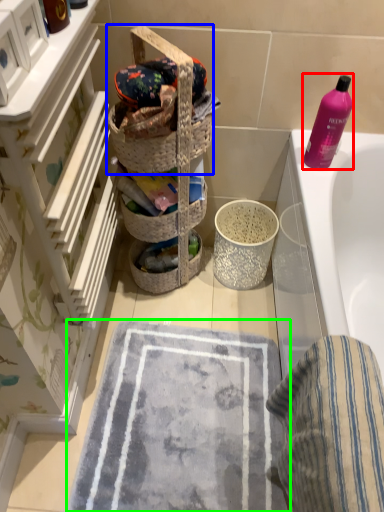
Question: Which object is positioned closest to cleaning product (highlighted by a red box)? Select from picnic basket (highlighted by a blue box) and bath mat (highlighted by a green box).

Choices:
 (A) picnic basket
 (B) bath mat

Answer: (A)